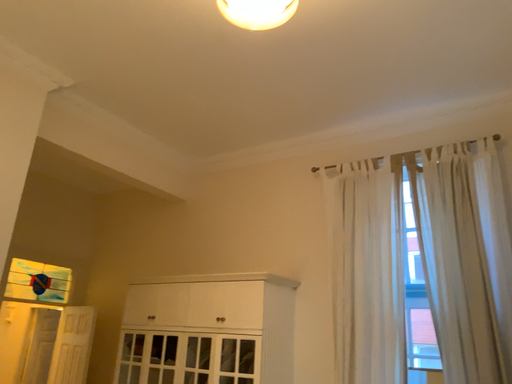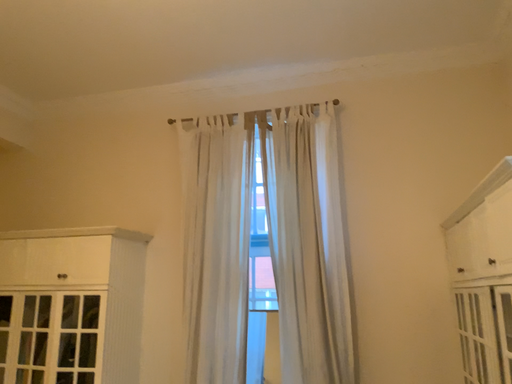
Question: Which way did the camera rotate in the video?

Choices:
 (A) rotated upward
 (B) rotated downward

Answer: (B)